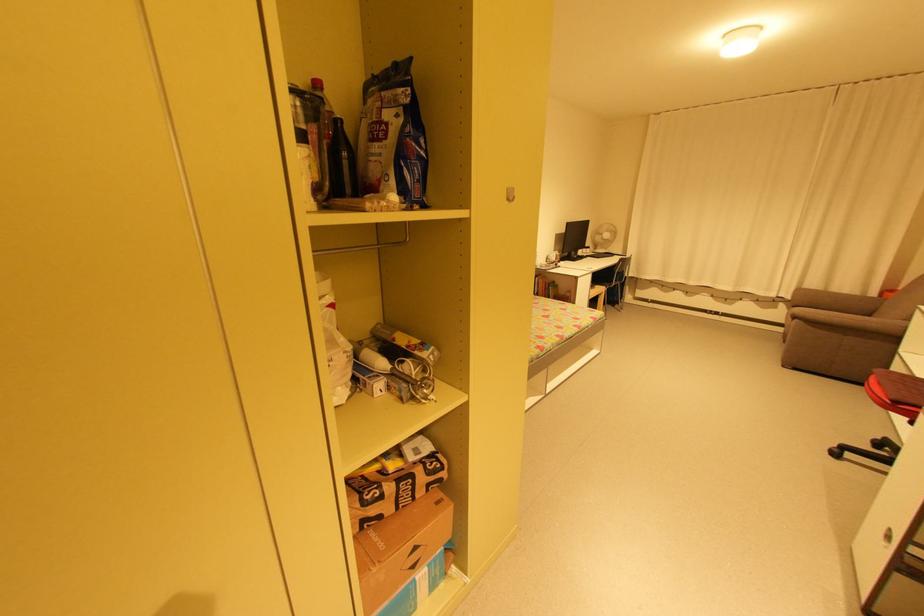
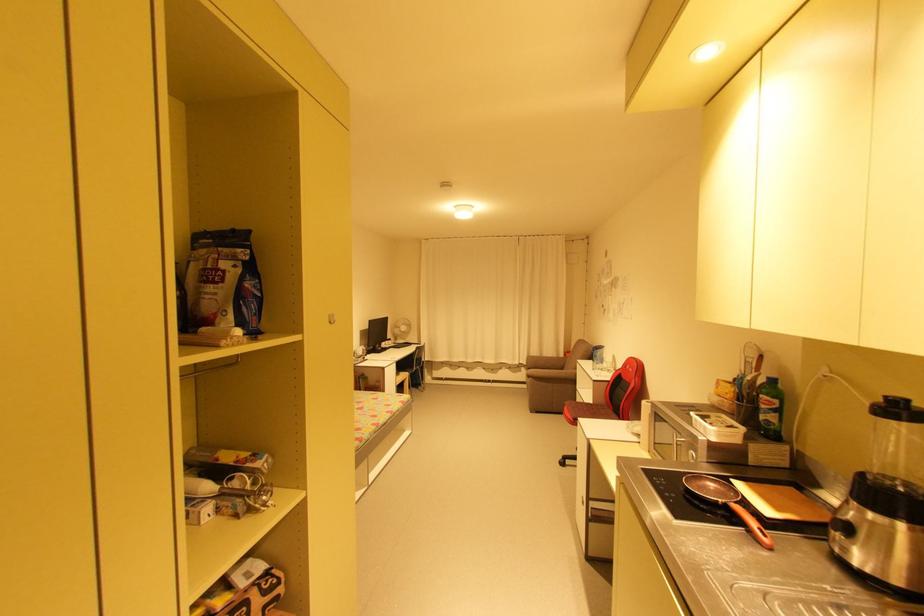
The point at (816, 329) is marked in the first image. Where is the corresponding point in the second image?

(542, 383)